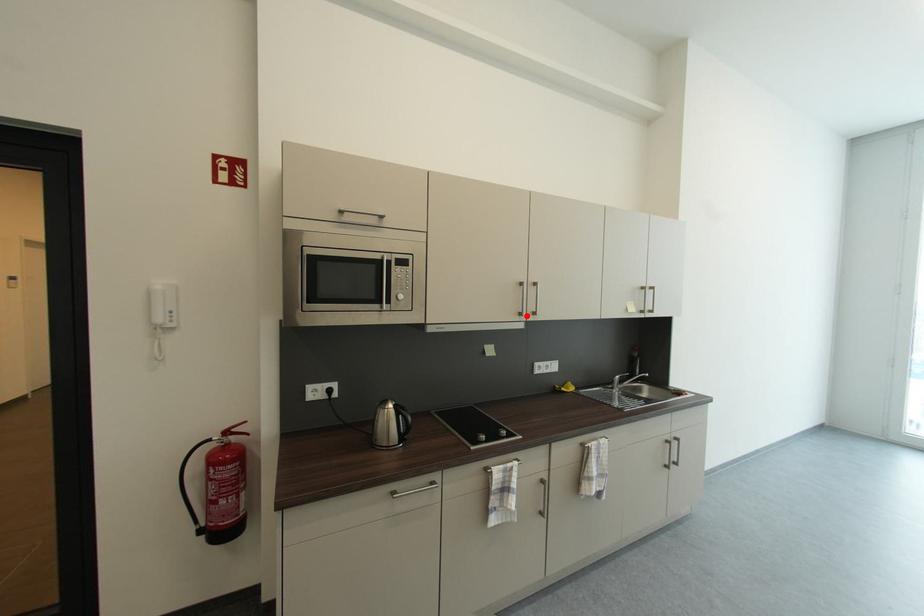
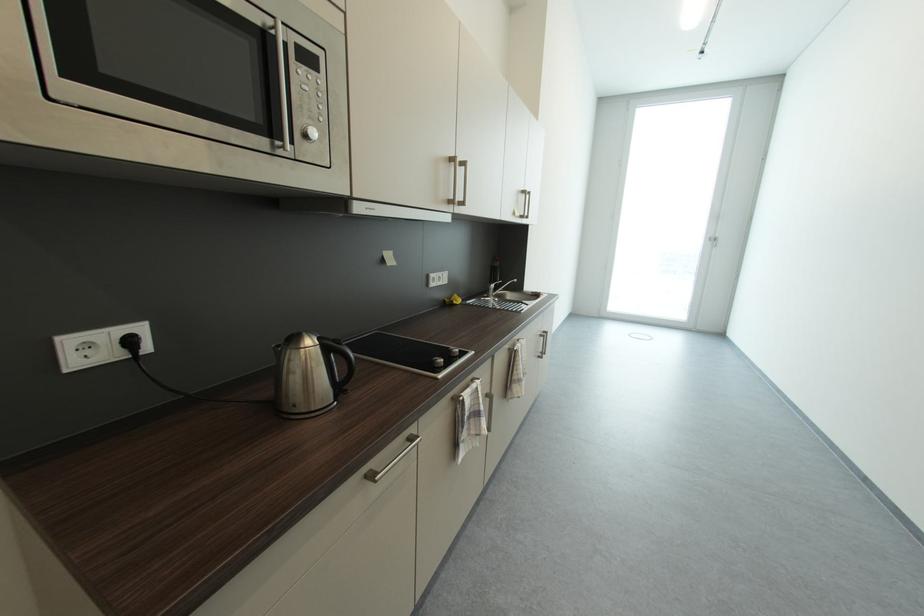
In the second image, find the point that corresponds to the highlighted location in the first image.

(457, 204)